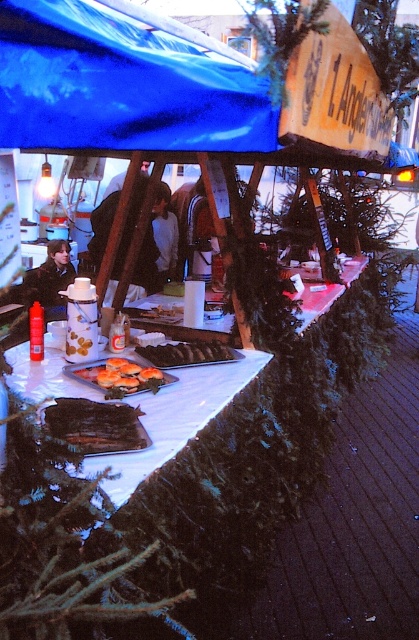
Does golden brown pastry at center have a smaller size compared to brown wooden skewers at center?

Correct, golden brown pastry at center occupies less space than brown wooden skewers at center.

Who is positioned more to the right, golden brown pastry at center or brown wooden skewers at center?

From the viewer's perspective, brown wooden skewers at center appears more on the right side.

Does point (126, 364) come farther from viewer compared to point (175, 358)?

No, it is in front of (175, 358).

Where is `golden brown pastry at center`? This screenshot has height=640, width=419. golden brown pastry at center is located at coordinates (121, 376).